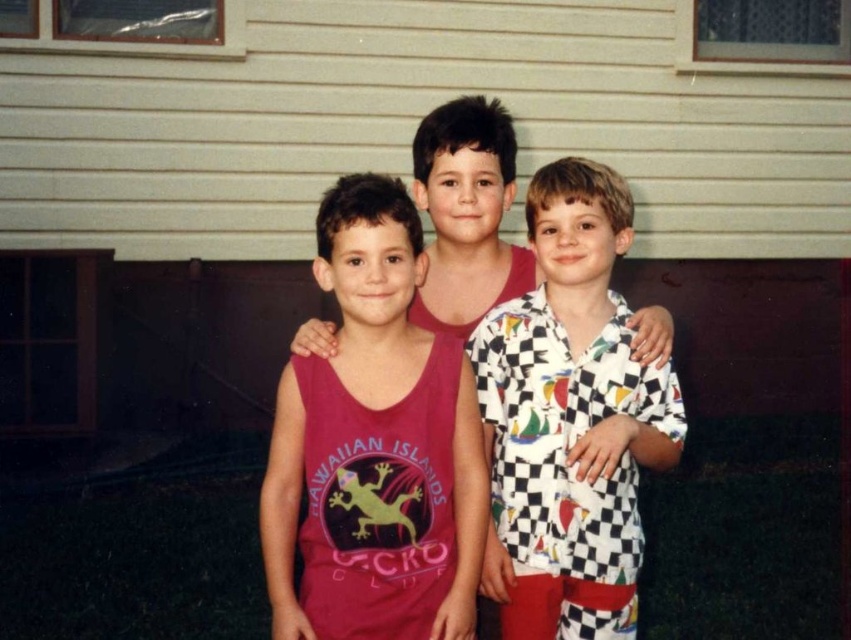
Question: Among these points, which one is farthest from the camera?

Choices:
 (A) (343, 435)
 (B) (505, 538)

Answer: (B)

Question: Where is matte pink tank top at center located in relation to white checkered shirt at center in the image?

Choices:
 (A) below
 (B) above

Answer: (B)

Question: Among these objects, which one is farthest from the camera?

Choices:
 (A) matte pink tank top at center
 (B) white checkered shirt at center

Answer: (B)

Question: Does matte pink tank top at center have a lesser width compared to white checkered shirt at center?

Choices:
 (A) no
 (B) yes

Answer: (A)

Question: Which of the following is the closest to the observer?

Choices:
 (A) white checkered shirt at center
 (B) matte pink tank top at center

Answer: (B)

Question: Does matte pink tank top at center lie behind white checkered shirt at center?

Choices:
 (A) yes
 (B) no

Answer: (B)